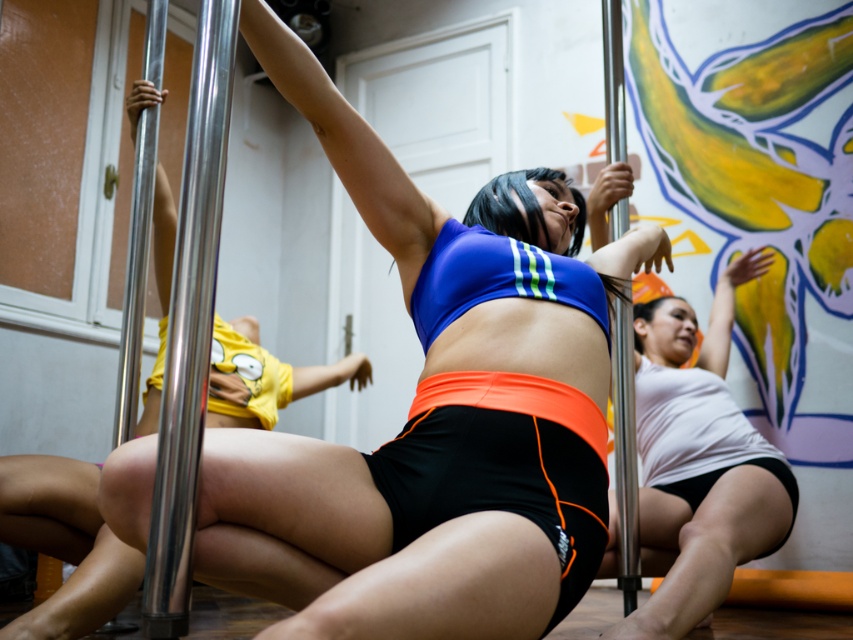
You are a photographer setting up for a pole dancing photoshoot. You have a matte blue sports bra at center and a polished silver pole at left in your frame. Based on their sizes, which object will appear closer to the camera?

The matte blue sports bra at center appears larger in size than the polished silver pole at left, so it will look closer to the camera.

You are standing at the point marked at coordinates point (535, 310). You want to move to the nearest pole. Which direction should you go?

The nearest pole is 1.44 meters away from point (535, 310). Since the poles are positioned to the left and right of the person in the foreground, you should move either left or right to reach the nearest pole.